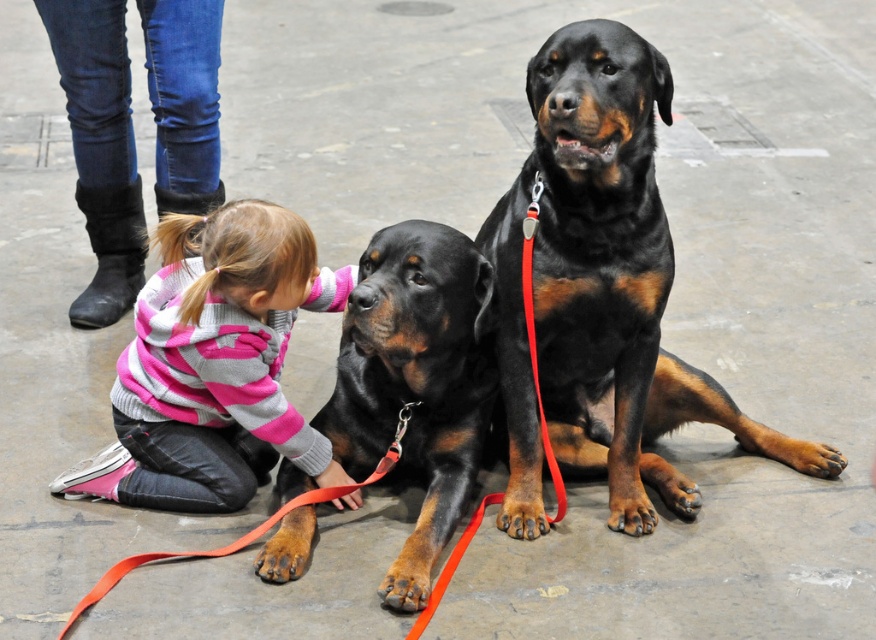
Question: Can you confirm if black glossy dog at center is positioned above pink striped sweater at lower left?

Choices:
 (A) yes
 (B) no

Answer: (A)

Question: Which of the following is the closest to the observer?

Choices:
 (A) (274, 396)
 (B) (634, 445)

Answer: (A)

Question: Does black glossy dog at center appear on the right side of pink striped sweater at lower left?

Choices:
 (A) no
 (B) yes

Answer: (B)

Question: Can you confirm if black glossy dog at center is bigger than pink striped sweater at lower left?

Choices:
 (A) yes
 (B) no

Answer: (A)

Question: Among these objects, which one is farthest from the camera?

Choices:
 (A) black glossy dog at center
 (B) pink striped sweater at lower left

Answer: (B)